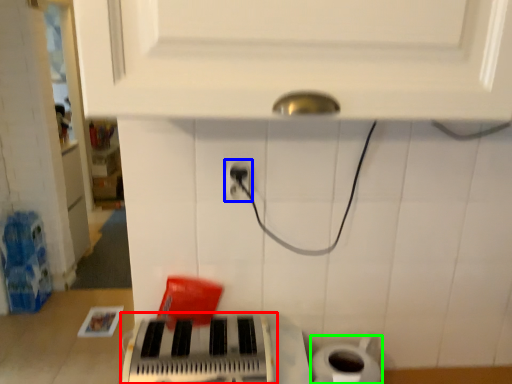
Question: Estimate the real-world distances between objects in this image. Which object is farther from musical keyboard (highlighted by a red box), power plugs and sockets (highlighted by a blue box) or toilet paper (highlighted by a green box)?

Choices:
 (A) power plugs and sockets
 (B) toilet paper

Answer: (A)